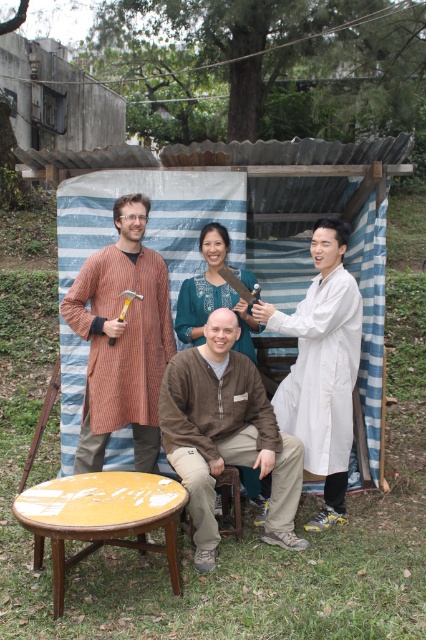
Based on the photo, does brown cotton shirt at center have a lesser width compared to blue embroidered blouse at center?

No, brown cotton shirt at center is not thinner than blue embroidered blouse at center.

Who is lower down, brown cotton shirt at center or blue embroidered blouse at center?

brown cotton shirt at center

Who is more forward, [181,368] or [213,291]?

Point [181,368] is more forward.

This screenshot has height=640, width=426. Find the location of `brown cotton shirt at center`. brown cotton shirt at center is located at coordinates (226, 435).

Which of these two, brown cotton shirt at center or white lab coat at right, stands taller?

With more height is white lab coat at right.

Who is more distant from viewer, (195, 532) or (276, 317)?

Point (276, 317)

Locate an element on the screen. This screenshot has width=426, height=640. brown cotton shirt at center is located at coordinates (226, 435).

Which is more to the right, brown cotton shirt at center or yellow painted wood stool at lower center?

brown cotton shirt at center is more to the right.

Based on the photo, which of these two, brown cotton shirt at center or yellow painted wood stool at lower center, stands taller?

brown cotton shirt at center is taller.

Is point (253, 422) in front of point (183, 528)?

No, (253, 422) is further to viewer.

This screenshot has width=426, height=640. I want to click on brown cotton shirt at center, so click(x=226, y=435).